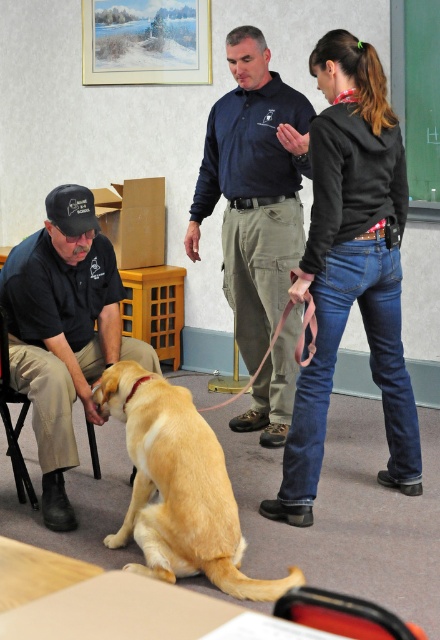
You are organizing a clothing donation drive and need to know which item takes up more space when folded. Based on the image, which is wider between the black cotton hoodie at center and the matte black shirt at left?

The black cotton hoodie at center is wider than the matte black shirt at left according to the description.

You are a photographer in the classroom. You want to take a photo of the golden fur dog at center without the matte black shirt at left appearing in the frame. Is this possible based on their positions?

The golden fur dog at center is behind the matte black shirt at left, so it is not possible to take a photo of the golden fur dog at center without the matte black shirt at left appearing in the frame because the dog is positioned behind the person.

From the picture: Where is the black cotton hoodie at center located in the scene?

The black cotton hoodie at center is located at the coordinates point (351, 268) in the scene.